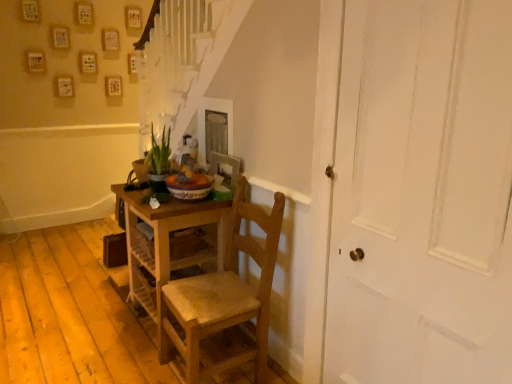
Question: Is wooden chair at center bigger than white painted wood door at right?

Choices:
 (A) yes
 (B) no

Answer: (A)

Question: From a real-world perspective, is wooden chair at center on top of white painted wood door at right?

Choices:
 (A) yes
 (B) no

Answer: (B)

Question: Can you confirm if wooden chair at center is taller than white painted wood door at right?

Choices:
 (A) no
 (B) yes

Answer: (A)

Question: From the image's perspective, is wooden chair at center beneath white painted wood door at right?

Choices:
 (A) yes
 (B) no

Answer: (A)

Question: Is wooden chair at center at the right side of white painted wood door at right?

Choices:
 (A) no
 (B) yes

Answer: (A)

Question: Considering the positions of point (161, 223) and point (437, 81), is point (161, 223) closer or farther from the camera than point (437, 81)?

Choices:
 (A) farther
 (B) closer

Answer: (A)

Question: From a real-world perspective, is wooden desk at center positioned above or below white painted wood door at right?

Choices:
 (A) above
 (B) below

Answer: (B)

Question: Looking at their shapes, would you say wooden desk at center is wider or thinner than white painted wood door at right?

Choices:
 (A) thin
 (B) wide

Answer: (B)

Question: Choose the correct answer: Is wooden desk at center inside white painted wood door at right or outside it?

Choices:
 (A) inside
 (B) outside

Answer: (B)

Question: From a real-world perspective, relative to white painted wood door at right, is wooden chair at center vertically above or below?

Choices:
 (A) above
 (B) below

Answer: (B)

Question: From their relative heights in the image, would you say wooden chair at center is taller or shorter than white painted wood door at right?

Choices:
 (A) tall
 (B) short

Answer: (B)

Question: Considering the positions of wooden chair at center and white painted wood door at right in the image, is wooden chair at center wider or thinner than white painted wood door at right?

Choices:
 (A) wide
 (B) thin

Answer: (A)

Question: Is wooden chair at center inside or outside of white painted wood door at right?

Choices:
 (A) inside
 (B) outside

Answer: (B)

Question: In the image, is white painted wood door at right on the left side or the right side of wooden chair at center?

Choices:
 (A) left
 (B) right

Answer: (B)

Question: Considering the positions of white painted wood door at right and wooden chair at center in the image, is white painted wood door at right bigger or smaller than wooden chair at center?

Choices:
 (A) small
 (B) big

Answer: (A)